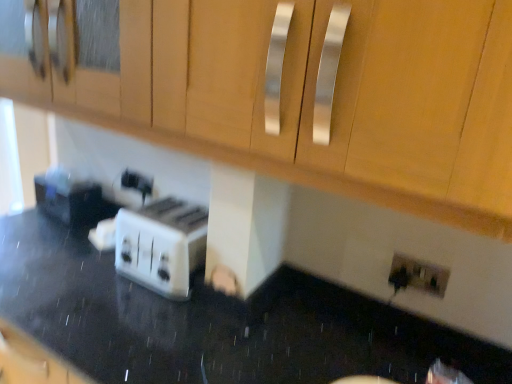
Identify the location of vacant space in front of white plastic toaster at center. (41, 230).